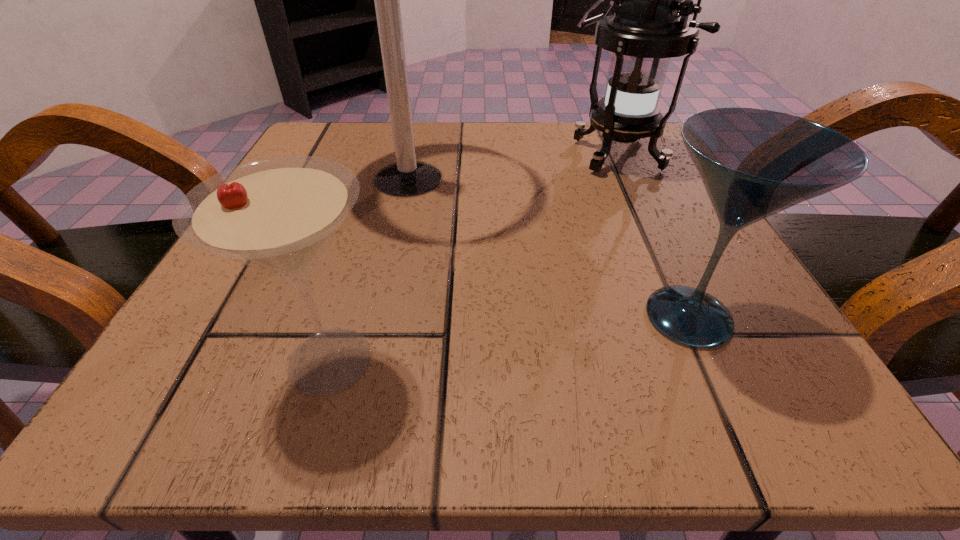
Locate an element on the screen. table lamp that is positioned at the left edge is located at coordinates (407, 177).

I want to click on martini that is positioned at the left edge, so click(x=278, y=214).

This screenshot has height=540, width=960. What are the coordinates of `lantern at the right edge` in the screenshot? It's located at (650, 25).

Identify the location of martini located in the right edge section of the desktop. The height and width of the screenshot is (540, 960). (754, 163).

Locate an element on the screen. The width and height of the screenshot is (960, 540). object that is at the far left corner is located at coordinates (407, 177).

In order to click on object present at the near left corner in this screenshot , I will do `click(278, 214)`.

This screenshot has height=540, width=960. What are the coordinates of `object located in the far right corner section of the desktop` in the screenshot? It's located at (650, 25).

Where is `object at the near right corner`? This screenshot has width=960, height=540. object at the near right corner is located at coordinates (754, 163).

This screenshot has height=540, width=960. Find the location of `free spot at the far edge of the desktop`. free spot at the far edge of the desktop is located at coordinates pyautogui.click(x=516, y=166).

The height and width of the screenshot is (540, 960). In order to click on vacant space at the near edge in this screenshot , I will do `click(472, 390)`.